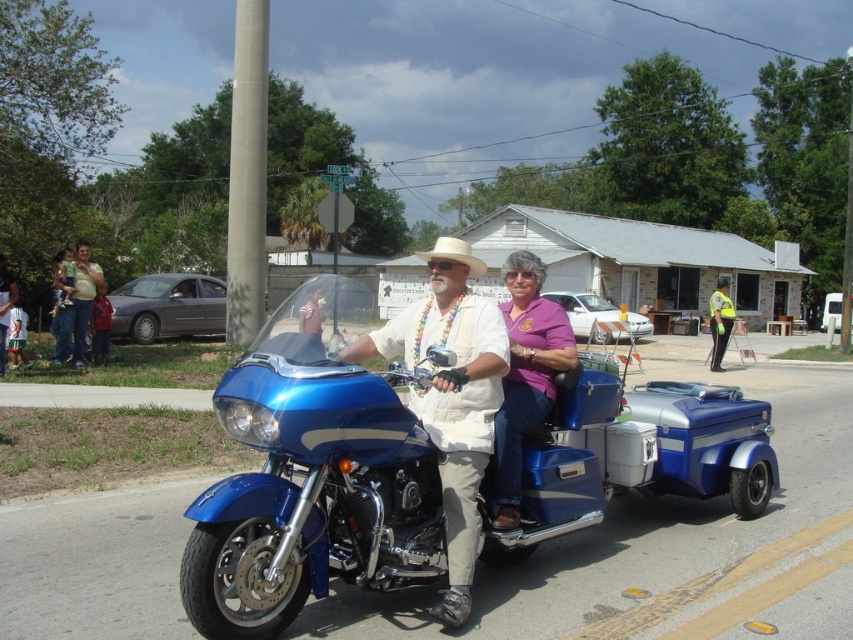
You are a photographer trying to capture the purple matte shirt at center in the image. The camera you are using has a fixed focus point at coordinates point (525, 374). Will the focus point align with the purple matte shirt at center?

Yes, the focus point at coordinates point (525, 374) aligns with the purple matte shirt at center since that point represents the location of the purple matte shirt at center.

You are a pedestrian standing on the side of the road and see the purple matte shirt at center and the reflective yellow vest at right. Which one is nearer to you?

The purple matte shirt at center is closer to the viewer than the reflective yellow vest at right.

From the picture: You are standing on the road and looking at the motorcycle with sidecar. There are two points marked on the motorcycle. Which point is closer to you, point (x=509, y=278) or point (x=718, y=317)?

Point (x=509, y=278) is closer to the viewer than point (x=718, y=317).